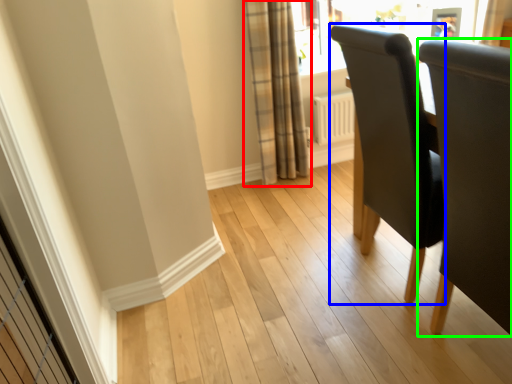
Question: Which object is positioned farthest from curtain (highlighted by a red box)? Select from chair (highlighted by a blue box) and chair (highlighted by a green box).

Choices:
 (A) chair
 (B) chair

Answer: (B)